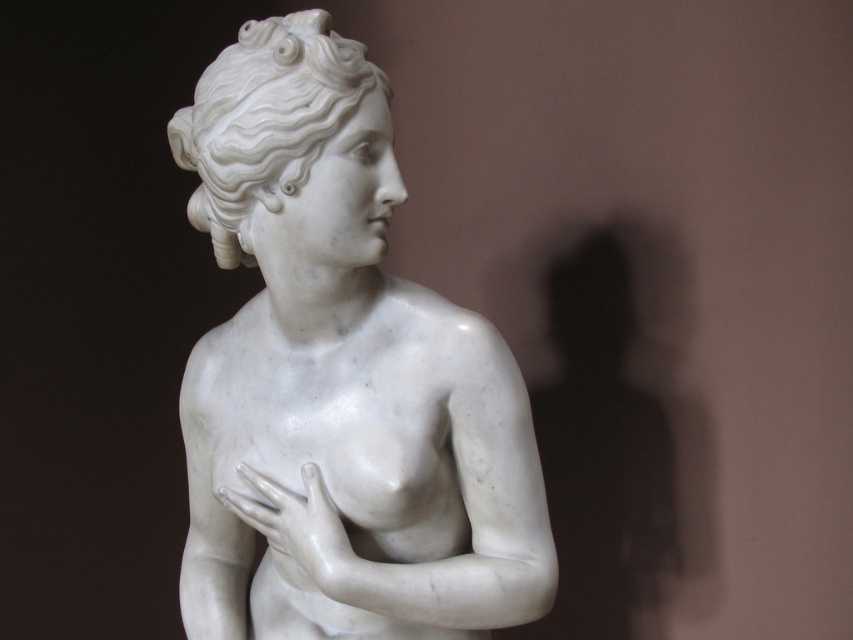
You are an art conservator working on a classical marble sculpture. You need to ensure that the white marble statue at center and the white marble hand at center are positioned correctly. According to the measurements, how far apart are these two parts?

The white marble statue at center is 4.06 inches away from the white marble hand at center.

You are an art conservator examining the classical marble sculpture. You notice two white marble pieces at the center of the image. One is labeled as the white marble statue at center and the other as the white marble hand at center. Which of these two objects is bigger in size?

The white marble statue at center is larger in size compared to the white marble hand at center.

Looking at this image, you are standing in front of a classical marble sculpture of a female figure. The statue is at the center of the image. What are the coordinates of the white marble statue at center?

The white marble statue at center is located at coordinates point (340, 378).